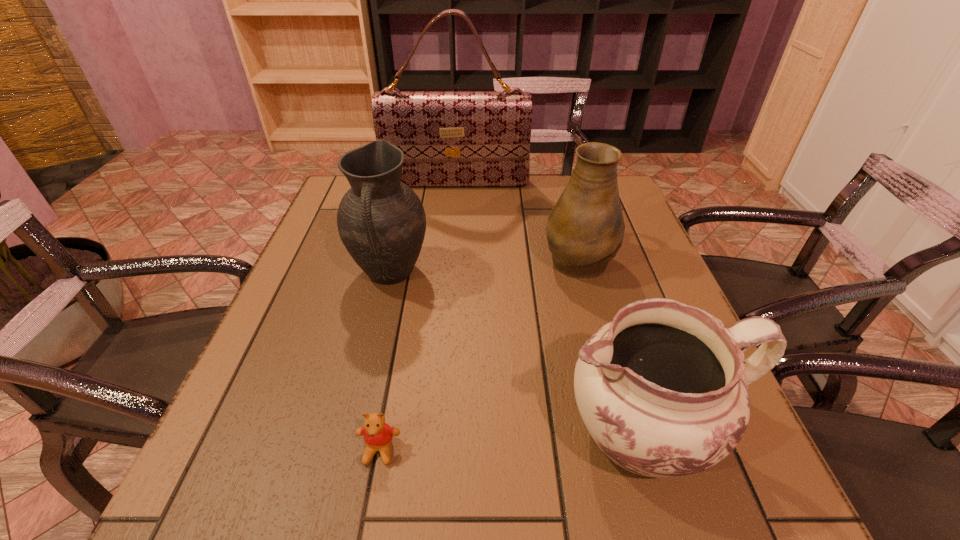
This screenshot has height=540, width=960. What are the coordinates of `pitcher that can be found as the third closest to the shortest object` in the screenshot? It's located at (585, 229).

Where is `the third closest pitcher to the tallest object`? The width and height of the screenshot is (960, 540). the third closest pitcher to the tallest object is located at coordinates (663, 390).

Locate an element on the screen. This screenshot has height=540, width=960. blank area in the image that satisfies the following two spatial constraints: 1. on the spout of the shortest pitcher; 2. on the front-facing side of the shortest object is located at coordinates (654, 450).

Where is `free space that satisfies the following two spatial constraints: 1. on the spout of the fourth tallest object; 2. on the front-facing side of the shortest object`? This screenshot has width=960, height=540. free space that satisfies the following two spatial constraints: 1. on the spout of the fourth tallest object; 2. on the front-facing side of the shortest object is located at coordinates (654, 450).